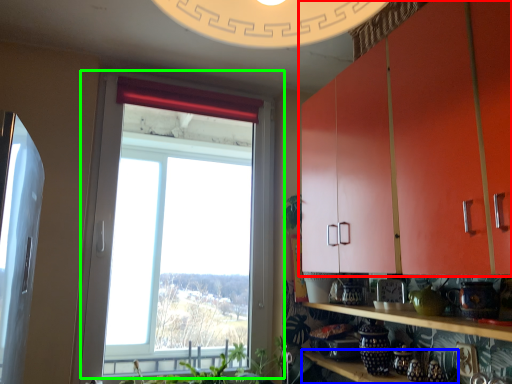
Question: Which object is positioned closest to cabinetry (highlighted by a red box)? Select from shelf (highlighted by a blue box) and window (highlighted by a green box).

Choices:
 (A) shelf
 (B) window

Answer: (A)